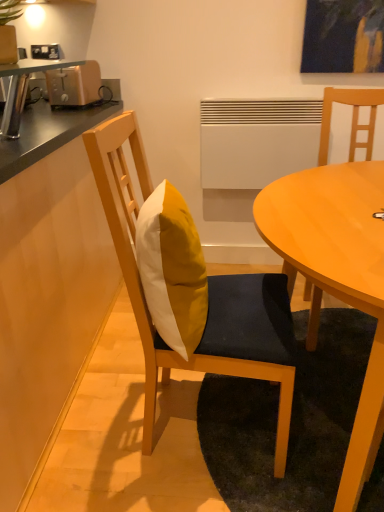
Locate an element on the screen. The width and height of the screenshot is (384, 512). vacant space situated above matte wood table at center (from a real-world perspective) is located at coordinates (338, 209).